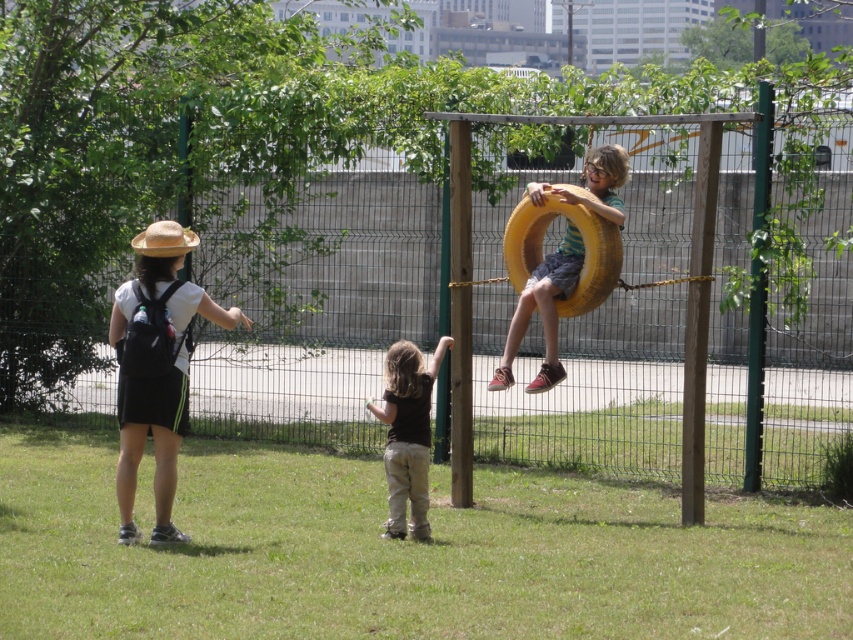
Who is shorter, straw hat at left or yellow rubber tire at center?

yellow rubber tire at center is shorter.

Describe the element at coordinates (155, 369) in the screenshot. I see `straw hat at left` at that location.

Is point (171, 500) behind point (550, 260)?

No, (171, 500) is closer to viewer.

This screenshot has width=853, height=640. I want to click on straw hat at left, so click(155, 369).

Can you confirm if yellow rubber tire at center is positioned to the right of brown cotton shirt at center?

Correct, you'll find yellow rubber tire at center to the right of brown cotton shirt at center.

Is yellow rubber tire at center positioned behind brown cotton shirt at center?

Yes, it is.

Where is `yellow rubber tire at center`? This screenshot has width=853, height=640. yellow rubber tire at center is located at coordinates (543, 310).

This screenshot has height=640, width=853. In order to click on yellow rubber tire at center in this screenshot , I will do `click(543, 310)`.

Is straw hat at left positioned in front of brown cotton shirt at center?

Yes, straw hat at left is in front of brown cotton shirt at center.

Locate an element on the screen. The image size is (853, 640). straw hat at left is located at coordinates (155, 369).

The height and width of the screenshot is (640, 853). In order to click on straw hat at left in this screenshot , I will do `click(155, 369)`.